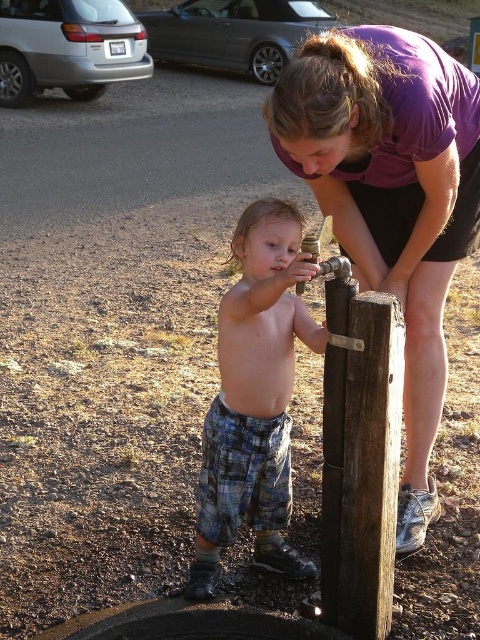
The scene shows a child and an adult near a water fountain. The child is wearing plaid shorts and standing on dry ground. The adult is leaning over the child. There is a parked silver minivan and a dark sedan in the background. The point at coordinates [254,397] corresponds to an object in the scene. What object is located at this point?

The point at coordinates [254,397] marks the plaid pants at center.

You are standing at the point marked as point (68, 48) in the image. What object is located at that coordinate?

The point (68, 48) corresponds to the silver metallic van at upper left.